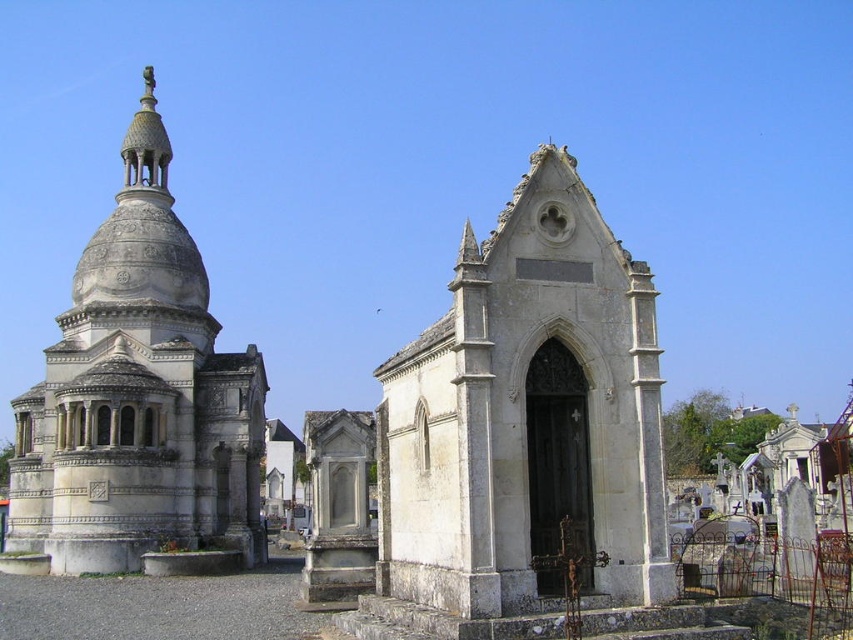
Does white stone chapel at center have a greater height compared to white stone dome at left?

In fact, white stone chapel at center may be shorter than white stone dome at left.

At what (x,y) coordinates should I click in order to perform the action: click on white stone chapel at center. Please return your answer as a coordinate pair (x, y). This screenshot has height=640, width=853. Looking at the image, I should click on (527, 417).

Locate an element on the screen. white stone chapel at center is located at coordinates (527, 417).